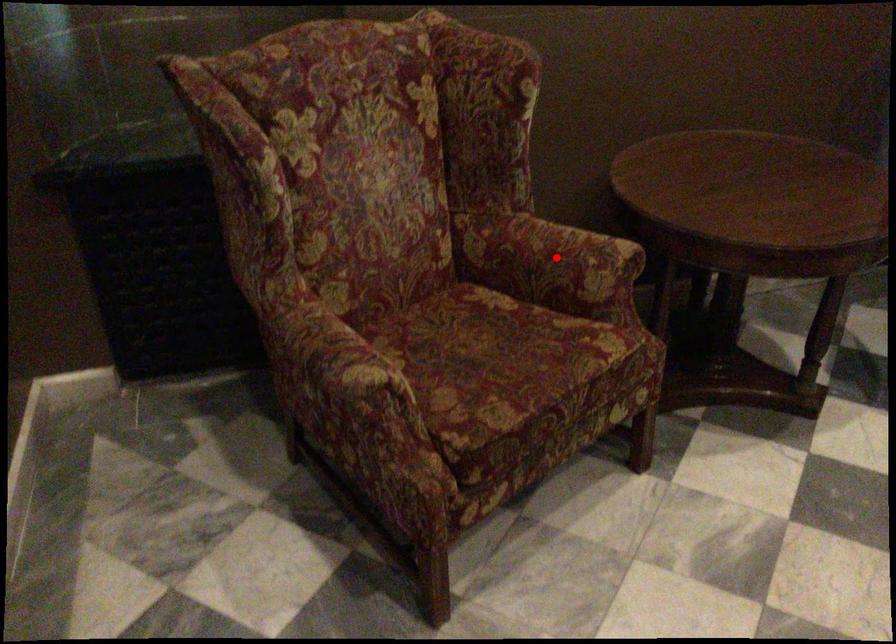
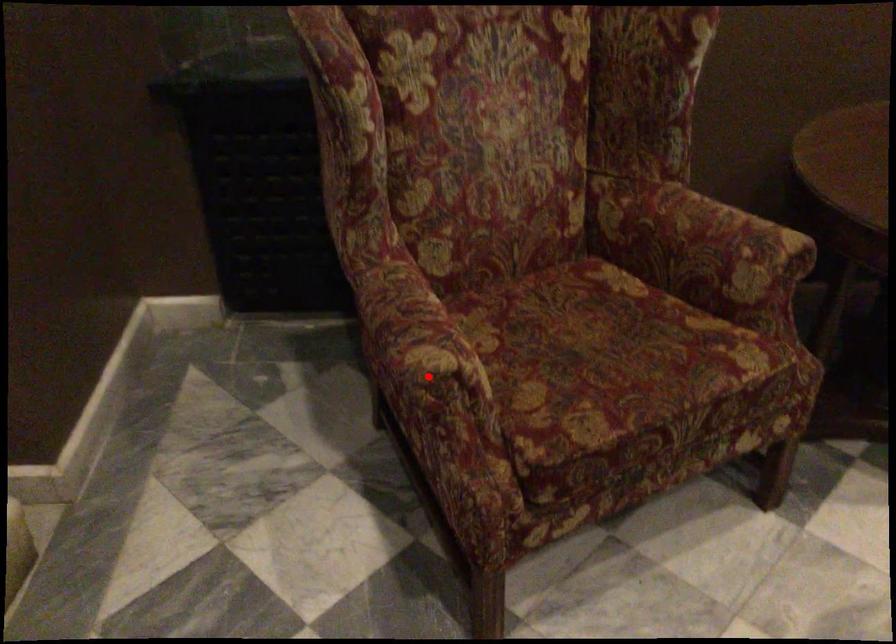
I am providing you with two images of the same scene from different viewpoints. A red point is marked on the first image and another point is marked on the second image. Do the highlighted points in image1 and image2 indicate the same real-world spot?

No